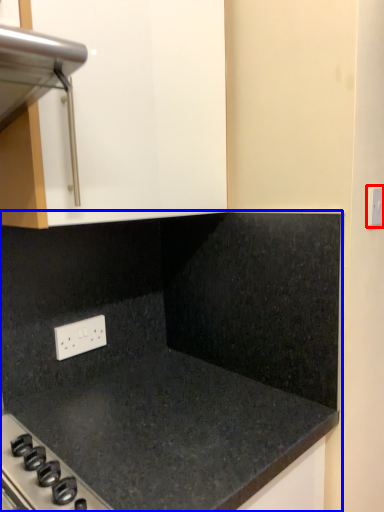
Question: Among these objects, which one is farthest to the camera, electric outlet (highlighted by a red box) or countertop (highlighted by a blue box)?

Choices:
 (A) electric outlet
 (B) countertop

Answer: (A)